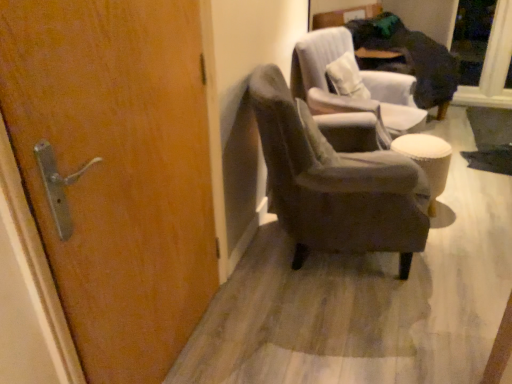
Question: Is velvet gray armchair at center, placed as the 1th chair when sorted from front to back, behind white fabric stool at right?

Choices:
 (A) yes
 (B) no

Answer: (B)

Question: Is velvet gray armchair at center, placed as the 2th chair when sorted from back to front, facing towards white fabric stool at right?

Choices:
 (A) no
 (B) yes

Answer: (B)

Question: From a real-world perspective, is velvet gray armchair at center, placed as the 1th chair when sorted from front to back, physically below white fabric stool at right?

Choices:
 (A) no
 (B) yes

Answer: (A)

Question: Is velvet gray armchair at center, placed as the 1th chair when sorted from front to back, at the right side of white fabric stool at right?

Choices:
 (A) yes
 (B) no

Answer: (B)

Question: Considering the relative sizes of velvet gray armchair at center, placed as the 1th chair when sorted from front to back, and white fabric stool at right in the image provided, is velvet gray armchair at center, placed as the 1th chair when sorted from front to back, thinner than white fabric stool at right?

Choices:
 (A) yes
 (B) no

Answer: (B)

Question: Is velvet gray armchair at center, placed as the 2th chair when sorted from back to front, positioned with its back to white fabric stool at right?

Choices:
 (A) no
 (B) yes

Answer: (A)

Question: Can you confirm if velvet gray armchair at center, placed as the 1th chair when sorted from front to back, is bigger than wooden door at left?

Choices:
 (A) no
 (B) yes

Answer: (B)

Question: Considering the relative positions of velvet gray armchair at center, placed as the 2th chair when sorted from back to front, and wooden door at left in the image provided, is velvet gray armchair at center, placed as the 2th chair when sorted from back to front, to the left of wooden door at left from the viewer's perspective?

Choices:
 (A) no
 (B) yes

Answer: (A)

Question: Considering the relative sizes of velvet gray armchair at center, placed as the 1th chair when sorted from front to back, and wooden door at left in the image provided, is velvet gray armchair at center, placed as the 1th chair when sorted from front to back, taller than wooden door at left?

Choices:
 (A) yes
 (B) no

Answer: (B)

Question: Is velvet gray armchair at center, placed as the 2th chair when sorted from back to front, behind wooden door at left?

Choices:
 (A) yes
 (B) no

Answer: (A)

Question: Is velvet gray armchair at center, placed as the 1th chair when sorted from front to back, positioned far away from wooden door at left?

Choices:
 (A) yes
 (B) no

Answer: (B)

Question: From the image's perspective, does velvet gray armchair at center, placed as the 2th chair when sorted from back to front, appear lower than wooden door at left?

Choices:
 (A) yes
 (B) no

Answer: (B)

Question: From the image's perspective, does velvet gray armchair at center, which appears as the 2th chair when viewed from the front, appear higher than velvet gray armchair at center, placed as the 1th chair when sorted from front to back?

Choices:
 (A) no
 (B) yes

Answer: (B)